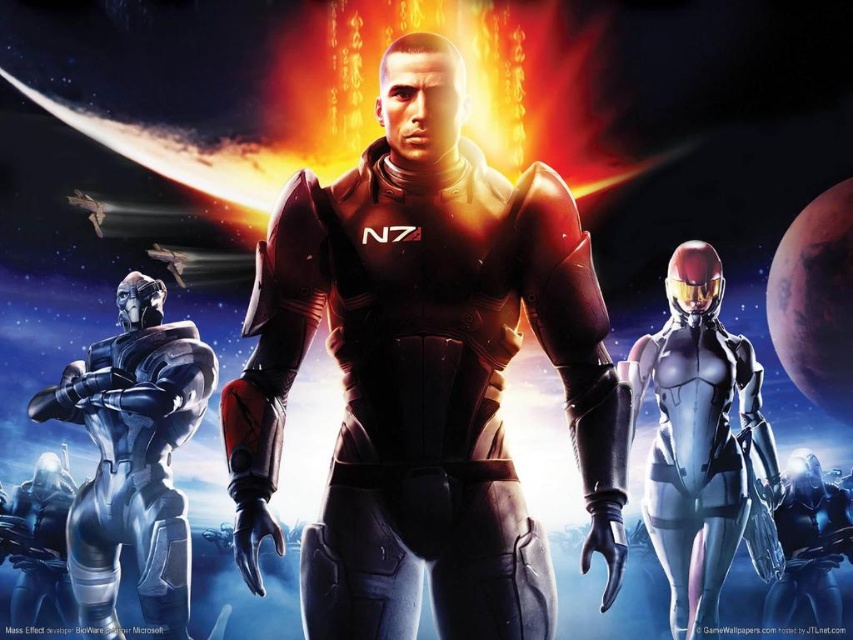
In the promotional artwork for the video game Mass Effect, there are three main characters. The central figure wears a red and black N7 suit, and another character to his left has a metallic blue suit. A point at coordinate (425, 374) marks a specific location. Which object at this coordinate is part of the central character or the metallic blue character?

The point at coordinate (425, 374) indicates shiny metallic armor at center, which is part of the central character wearing the red and black N7 suit.

Based on the scene description, where exactly is the shiny metallic armor at center located in the image?

The shiny metallic armor at center is located at point 0.586 on the x axis and 0.499 on the y axis.

You are analyzing the promotional artwork for the video game Mass Effect. The scene shows three main characters with the shiny metallic armor at center. Where exactly is the shiny metallic armor positioned in the image?

The shiny metallic armor at center is located at point coordinates of 0.586 along the horizontal axis and 0.499 along the vertical axis.